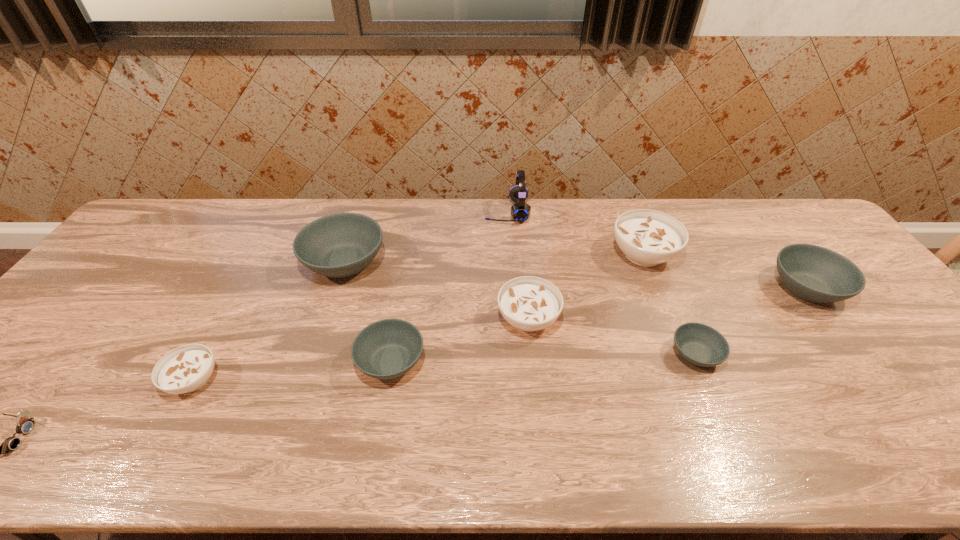
Where is `headset`? This screenshot has height=540, width=960. headset is located at coordinates (520, 211).

The width and height of the screenshot is (960, 540). What are the coordinates of `the farthest object` in the screenshot? It's located at (520, 211).

The image size is (960, 540). Identify the location of the rightmost white soup bowl. (647, 237).

The image size is (960, 540). Identify the location of the biggest white soup bowl. click(647, 237).

I want to click on the biggest gray soup bowl, so pyautogui.click(x=340, y=245).

In order to click on the rightmost object in this screenshot , I will do `click(812, 273)`.

Image resolution: width=960 pixels, height=540 pixels. Identify the location of the rightmost soup bowl. (812, 273).

Where is `the second farthest white soup bowl`? This screenshot has height=540, width=960. the second farthest white soup bowl is located at coordinates (528, 303).

The image size is (960, 540). I want to click on the second white soup bowl from left to right, so click(x=528, y=303).

Identify the location of the third biggest gray soup bowl. This screenshot has width=960, height=540. (386, 349).